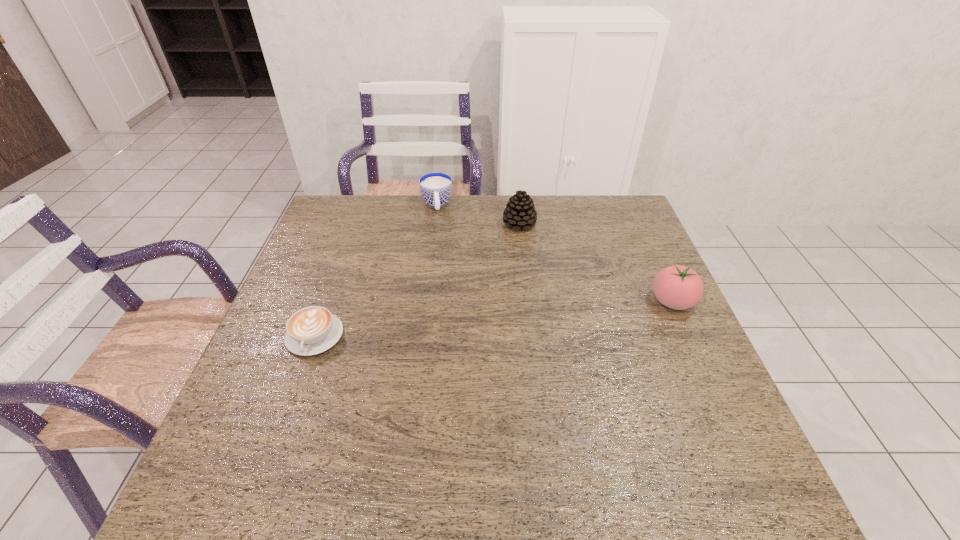
Locate an element on the screen. the shortest object is located at coordinates (312, 330).

Identify the location of cappuccino. The width and height of the screenshot is (960, 540). (312, 330).

Where is `the rightmost object`? the rightmost object is located at coordinates point(678,287).

Find the location of a particular element. Image resolution: width=960 pixels, height=540 pixels. pinecone is located at coordinates (520, 212).

The width and height of the screenshot is (960, 540). What are the coordinates of `the second object from left to right` in the screenshot? It's located at [x=435, y=187].

You are a GUI agent. You are given a task and a screenshot of the screen. Output one action in this format:
    pyautogui.click(x=<x>, y=<y>)
    Task: Click on the cup
    This screenshot has height=540, width=960.
    Given the screenshot: What is the action you would take?
    click(435, 187)

The height and width of the screenshot is (540, 960). Find the location of `vacant space located 0.070m on the side of the cappuccino with the handle`. vacant space located 0.070m on the side of the cappuccino with the handle is located at coordinates (297, 386).

This screenshot has width=960, height=540. In order to click on free space located 0.280m on the front of the rightmost object in this screenshot , I will do `click(726, 418)`.

The width and height of the screenshot is (960, 540). Find the location of `free space located 0.200m at the narrow end of the third object from left to right`. free space located 0.200m at the narrow end of the third object from left to right is located at coordinates (502, 274).

This screenshot has height=540, width=960. Identify the location of vacant space positioned at the narrow end of the third object from left to right. (508, 259).